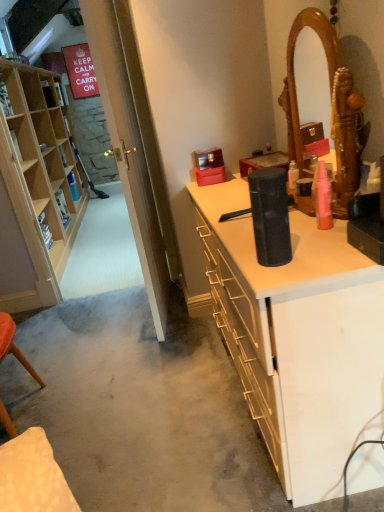
Question: Considering the positions of light wood cabinet at left and pink matte spray can at upper right in the image, is light wood cabinet at left wider or thinner than pink matte spray can at upper right?

Choices:
 (A) thin
 (B) wide

Answer: (B)

Question: Looking at the image, does light wood cabinet at left seem bigger or smaller compared to pink matte spray can at upper right?

Choices:
 (A) big
 (B) small

Answer: (A)

Question: Which is nearer to the black matte speaker at center?

Choices:
 (A) light wood cabinet at left
 (B) pink matte spray can at upper right
 (C) black matte speaker at center
 (D) transparent glass door at left

Answer: (C)

Question: Considering the real-world distances, which object is farthest from the light wood cabinet at left?

Choices:
 (A) black matte speaker at center
 (B) pink matte spray can at upper right
 (C) black matte speaker at center
 (D) transparent glass door at left

Answer: (B)